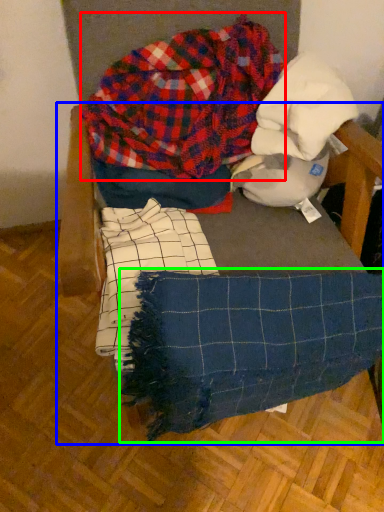
Question: Which object is the closest to the flannel (highlighted by a red box)? Choose among these: furniture (highlighted by a blue box) or blanket (highlighted by a green box).

Choices:
 (A) furniture
 (B) blanket

Answer: (A)